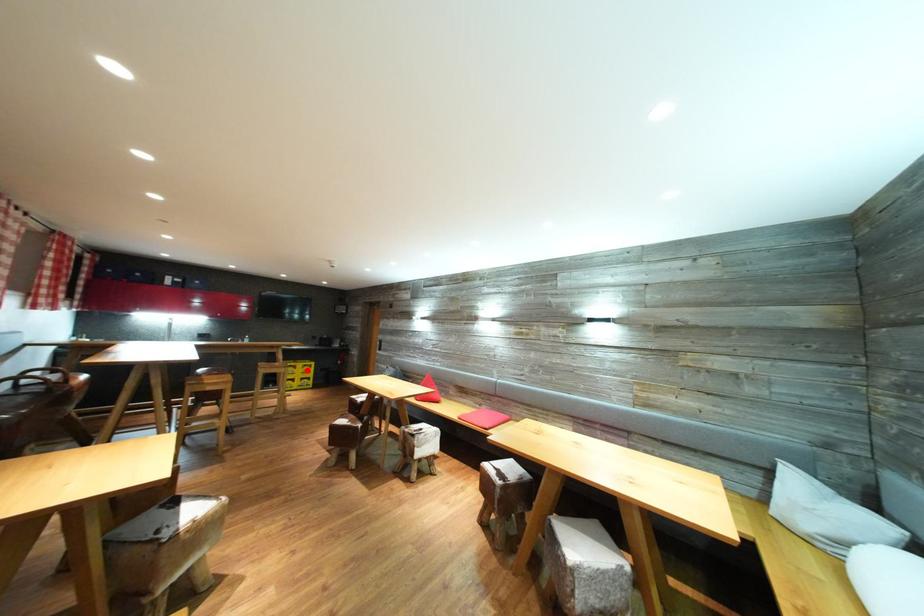
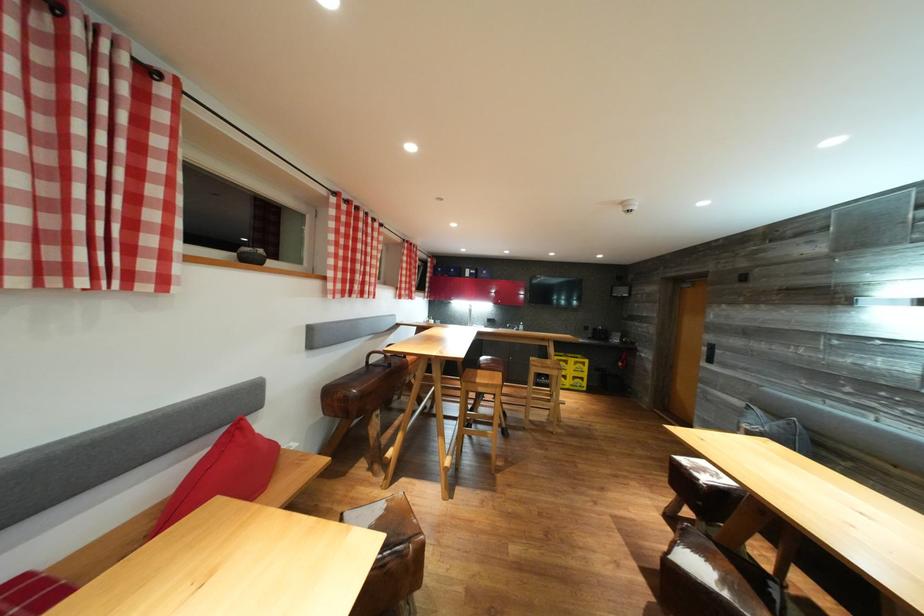
Where in the second image is the point corresponding to the highlighted location from the first image?

(578, 366)